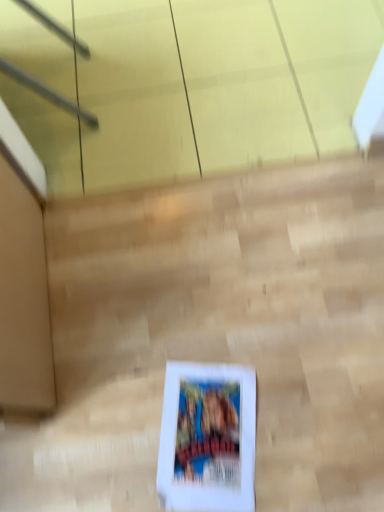
This screenshot has width=384, height=512. I want to click on free space above white paper at center (from a real-world perspective), so click(213, 434).